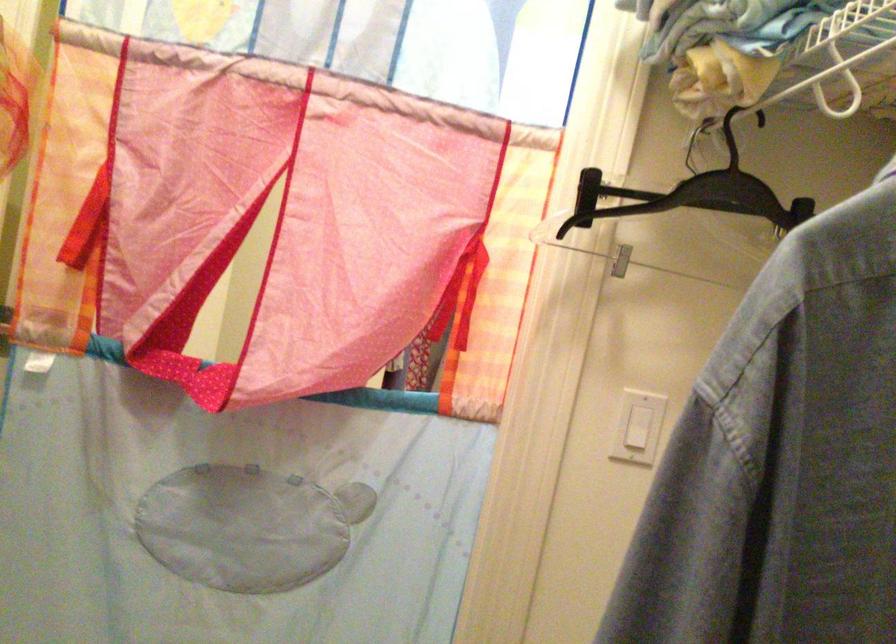
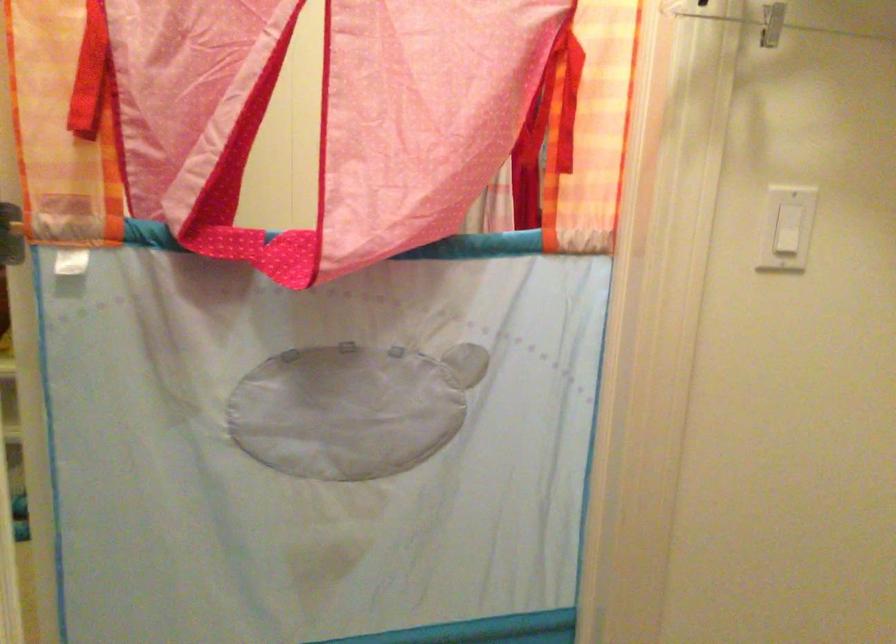
Question: How did the camera likely rotate?

Choices:
 (A) Left
 (B) Right
 (C) Up
 (D) Down

Answer: (D)